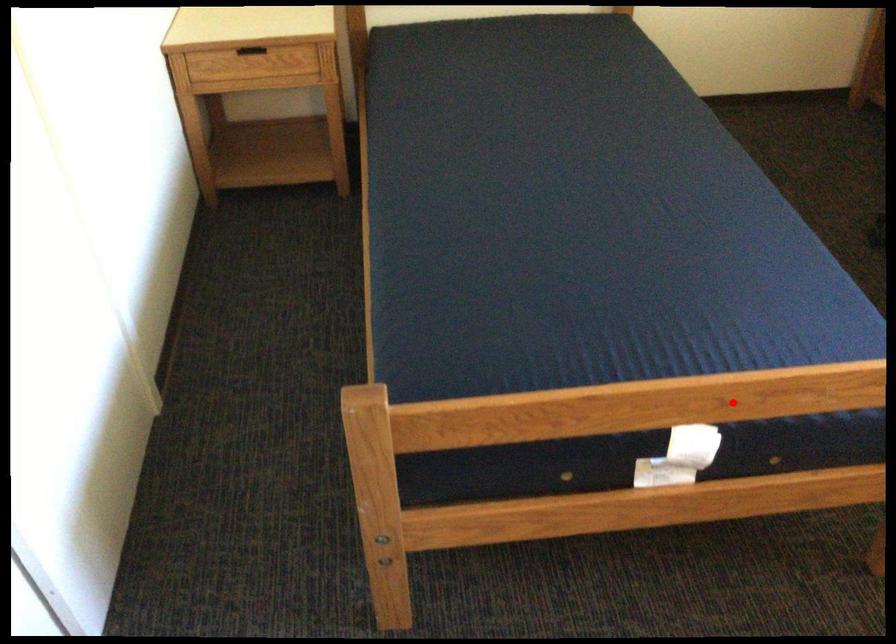
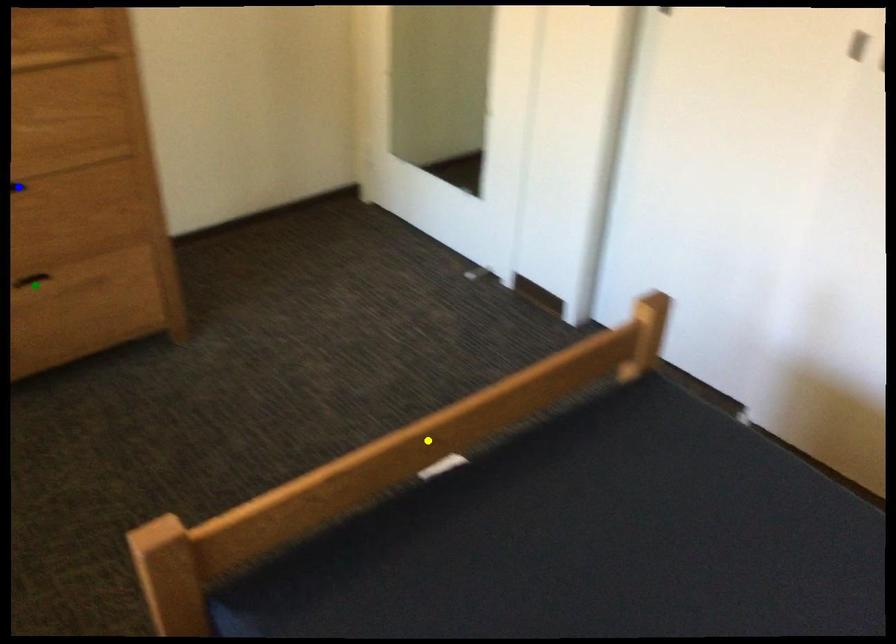
Question: I am providing you with two images of the same scene from different viewpoints. A red point is marked on the first image. You are given multiple points on the second image. Which mark in image 2 goes with the point in image 1?

Choices:
 (A) yellow point
 (B) blue point
 (C) green point

Answer: (A)